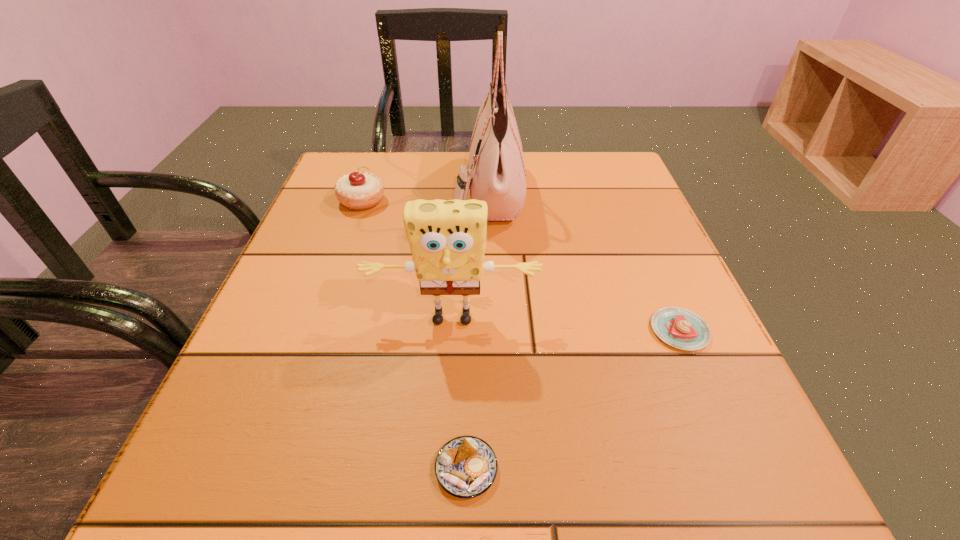
You are a GUI agent. You are given a task and a screenshot of the screen. Output one action in this format:
    pyautogui.click(x=<x>, y=<y>)
    Task: Click on the object that is positioned at the far left corner
    This screenshot has height=540, width=960.
    Given the screenshot: What is the action you would take?
    pyautogui.click(x=363, y=190)

Image resolution: width=960 pixels, height=540 pixels. What are the coordinates of `vacant region at the far edge` in the screenshot? It's located at [564, 189].

Identify the location of free space at the left edge of the desktop. The image size is (960, 540). (289, 255).

Locate an element on the screen. The width and height of the screenshot is (960, 540). vacant space at the right edge of the desktop is located at coordinates (659, 423).

You are a GUI agent. You are given a task and a screenshot of the screen. Output one action in this format:
    pyautogui.click(x=<x>, y=<y>)
    Task: Click on the vacant area at the far right corner
    The image size is (960, 540).
    Given the screenshot: What is the action you would take?
    pyautogui.click(x=576, y=177)

The height and width of the screenshot is (540, 960). I want to click on vacant space at the near right corner, so click(742, 498).

This screenshot has height=540, width=960. I want to click on empty location between the nearest object and the leftmost object, so click(415, 335).

At what (x,y) coordinates should I click in order to perform the action: click on free space between the rightmost pastry and the nearest pastry. Please return your answer as a coordinate pair (x, y). Looking at the image, I should click on click(573, 400).

You are a GUI agent. You are given a task and a screenshot of the screen. Output one action in this format:
    pyautogui.click(x=<x>, y=<y>)
    Task: Click on the free space between the nearest pastry and the rightmost object
    This screenshot has width=960, height=540.
    Given the screenshot: What is the action you would take?
    pyautogui.click(x=573, y=400)

Where is `empty location between the leftmost pastry and the sponge`? The width and height of the screenshot is (960, 540). empty location between the leftmost pastry and the sponge is located at coordinates (407, 260).